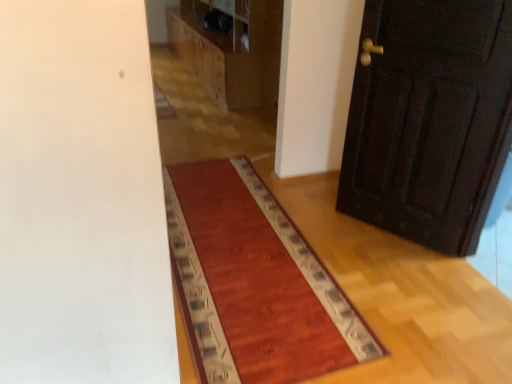
Question: Would you say rug with patterned border at center is part of wooden dresser at upper center's contents?

Choices:
 (A) no
 (B) yes

Answer: (A)

Question: Considering the relative sizes of wooden dresser at upper center and rug with patterned border at center in the image provided, is wooden dresser at upper center taller than rug with patterned border at center?

Choices:
 (A) yes
 (B) no

Answer: (A)

Question: Considering the relative sizes of wooden dresser at upper center and rug with patterned border at center in the image provided, is wooden dresser at upper center shorter than rug with patterned border at center?

Choices:
 (A) yes
 (B) no

Answer: (B)

Question: Does wooden dresser at upper center have a larger size compared to rug with patterned border at center?

Choices:
 (A) yes
 (B) no

Answer: (A)

Question: From a real-world perspective, is wooden dresser at upper center over rug with patterned border at center?

Choices:
 (A) yes
 (B) no

Answer: (A)

Question: Is wooden dresser at upper center at the left side of rug with patterned border at center?

Choices:
 (A) yes
 (B) no

Answer: (A)

Question: Is rug with patterned border at center facing away from wooden dresser at upper center?

Choices:
 (A) no
 (B) yes

Answer: (A)

Question: Is rug with patterned border at center bigger than wooden dresser at upper center?

Choices:
 (A) yes
 (B) no

Answer: (B)

Question: Are rug with patterned border at center and wooden dresser at upper center making contact?

Choices:
 (A) yes
 (B) no

Answer: (B)

Question: Does rug with patterned border at center have a greater width compared to wooden dresser at upper center?

Choices:
 (A) yes
 (B) no

Answer: (A)

Question: From a real-world perspective, is rug with patterned border at center located higher than wooden dresser at upper center?

Choices:
 (A) yes
 (B) no

Answer: (B)

Question: Considering the relative positions of rug with patterned border at center and wooden dresser at upper center in the image provided, is rug with patterned border at center to the right of wooden dresser at upper center from the viewer's perspective?

Choices:
 (A) no
 (B) yes

Answer: (B)

Question: Can you confirm if dark wood door at right is shorter than wooden dresser at upper center?

Choices:
 (A) no
 (B) yes

Answer: (A)